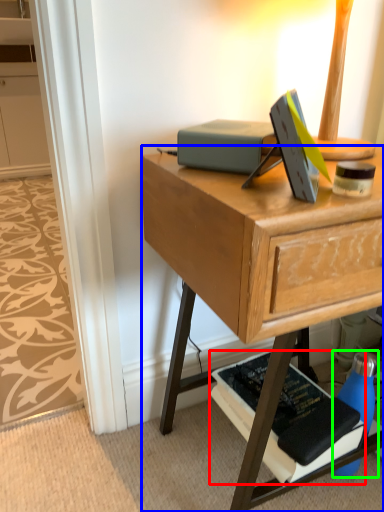
Question: Which object is the closest to the paperback book (highlighted by a red box)? Choose among these: desk (highlighted by a blue box) or bottle (highlighted by a green box).

Choices:
 (A) desk
 (B) bottle

Answer: (B)